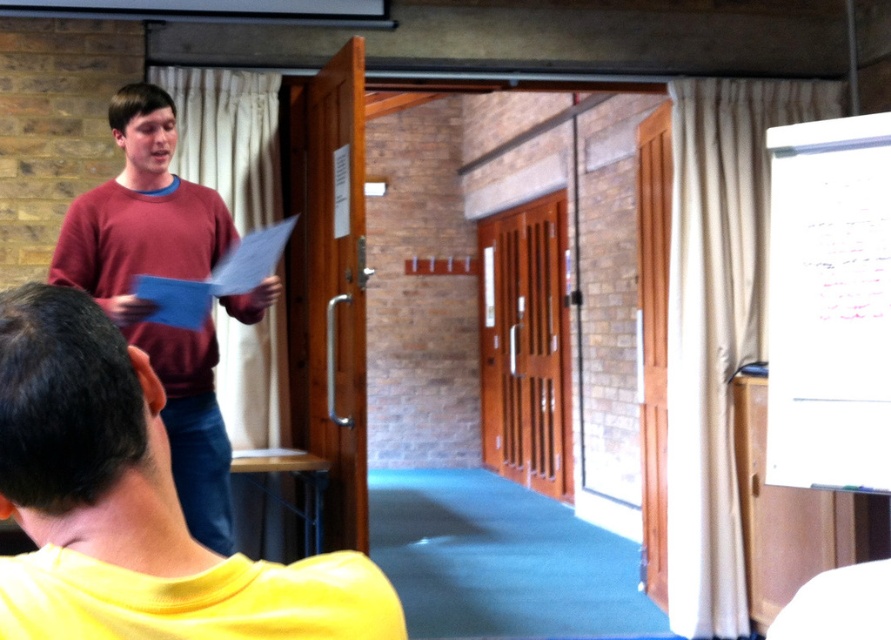
Question: Among these points, which one is nearest to the camera?

Choices:
 (A) (227, 548)
 (B) (347, 634)

Answer: (B)

Question: Among these points, which one is farthest from the camera?

Choices:
 (A) (124, 212)
 (B) (56, 465)

Answer: (A)

Question: Can you confirm if yellow matte shirt at lower left is wider than maroon sweater at left?

Choices:
 (A) no
 (B) yes

Answer: (A)

Question: Can you confirm if yellow matte shirt at lower left is positioned above maroon sweater at left?

Choices:
 (A) no
 (B) yes

Answer: (A)

Question: Among these objects, which one is farthest from the camera?

Choices:
 (A) maroon sweater at left
 (B) yellow matte shirt at lower left

Answer: (A)

Question: Does yellow matte shirt at lower left appear on the right side of maroon sweater at left?

Choices:
 (A) no
 (B) yes

Answer: (B)